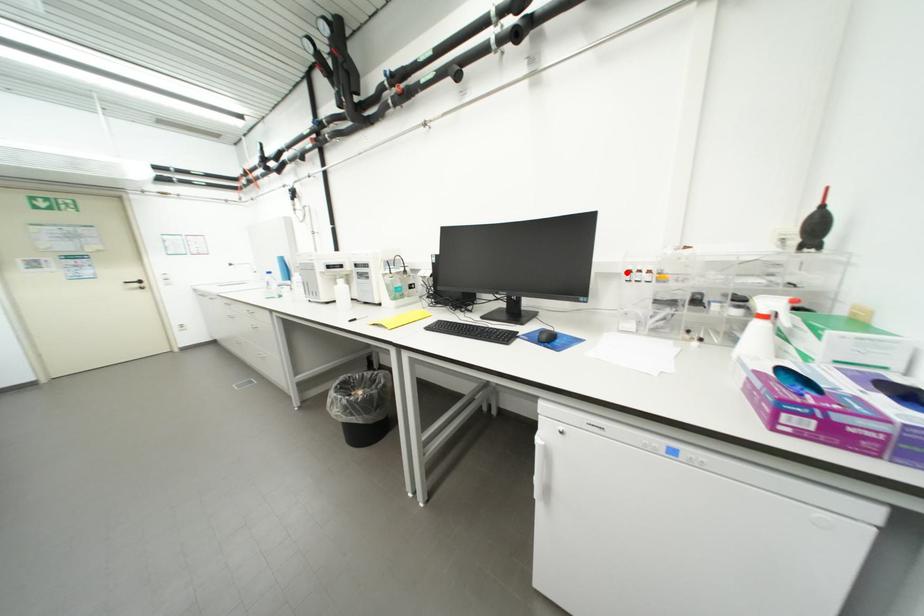
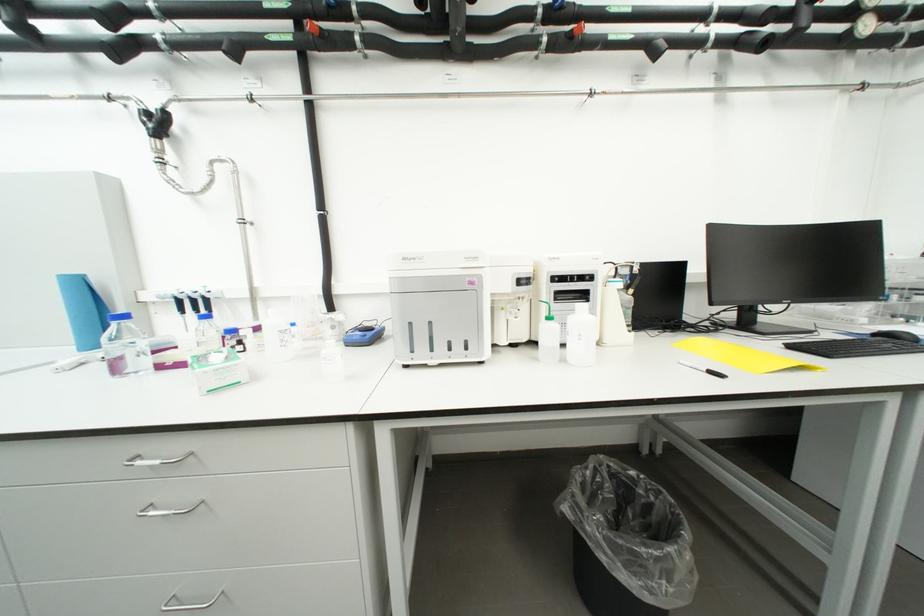
Question: I am providing you with two images of the same scene from different viewpoints. A red point is marked on the first image. At the location where the point appears in image 1, is it still visible in image 2?

Choices:
 (A) Yes
 (B) No

Answer: (B)